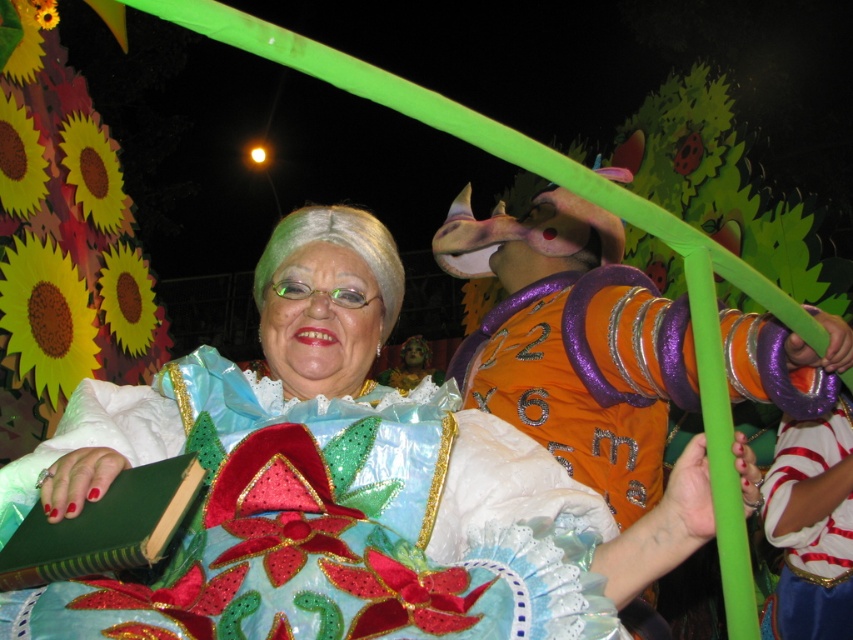
Question: Is shiny satin dress at center thinner than white matte wig at center?

Choices:
 (A) no
 (B) yes

Answer: (A)

Question: Which point is closer to the camera taking this photo?

Choices:
 (A) (376, 285)
 (B) (495, 500)

Answer: (B)

Question: Which object appears farthest from the camera in this image?

Choices:
 (A) shiny satin dress at center
 (B) white matte wig at center

Answer: (B)

Question: In this image, where is shiny satin dress at center located relative to white matte wig at center?

Choices:
 (A) left
 (B) right

Answer: (B)

Question: Can you confirm if shiny satin dress at center is bigger than white matte wig at center?

Choices:
 (A) no
 (B) yes

Answer: (A)